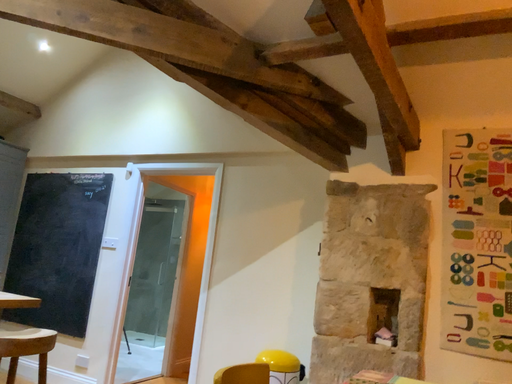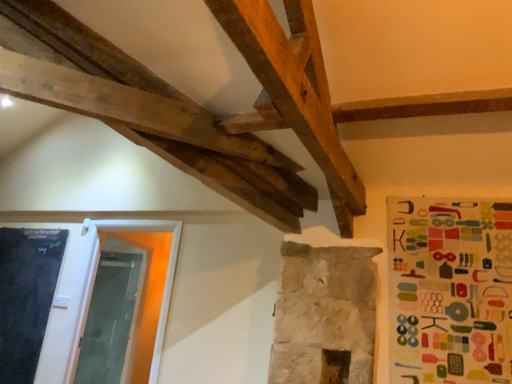
Question: How did the camera likely rotate when shooting the video?

Choices:
 (A) rotated downward
 (B) rotated upward

Answer: (B)